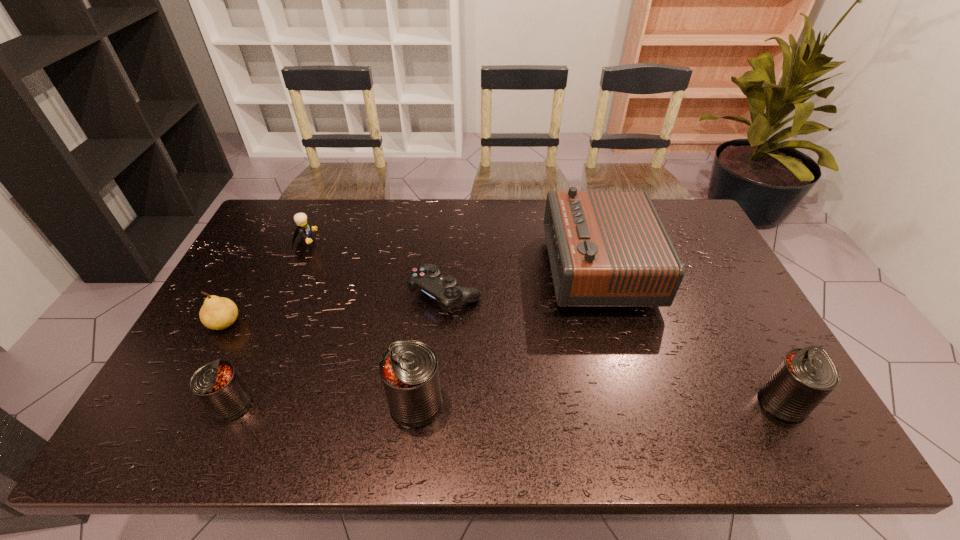
Identify which object is located as the second nearest to the shortest can. Please provide its 2D coordinates. Your answer should be formatted as a tuple, i.e. [(x, y)], where the tuple contains the x and y coordinates of a point satisfying the conditions above.

[(409, 370)]

Identify the location of object that is the second closest to the pear. (304, 228).

Where is `the closest can to the third tallest object`? This screenshot has width=960, height=540. the closest can to the third tallest object is located at coordinates click(x=409, y=370).

The width and height of the screenshot is (960, 540). I want to click on can object that ranks as the closest to the rightmost object, so click(409, 370).

You are a GUI agent. You are given a task and a screenshot of the screen. Output one action in this format:
    pyautogui.click(x=<x>, y=<y>)
    Task: Click on the vacant area that satisfies the following two spatial constraints: 1. on the front panel of the radio receiver; 2. on the front side of the second can from right to left
    The width and height of the screenshot is (960, 540).
    Given the screenshot: What is the action you would take?
    tap(636, 404)

Locate an element on the screen. The height and width of the screenshot is (540, 960). free spot that satisfies the following two spatial constraints: 1. on the back side of the shortest can; 2. on the left side of the second can from left to right is located at coordinates (232, 404).

Where is `vacant space that satisfies the following two spatial constraints: 1. on the front panel of the second object from right to left; 2. on the front side of the second can from right to left`? This screenshot has width=960, height=540. vacant space that satisfies the following two spatial constraints: 1. on the front panel of the second object from right to left; 2. on the front side of the second can from right to left is located at coordinates (636, 404).